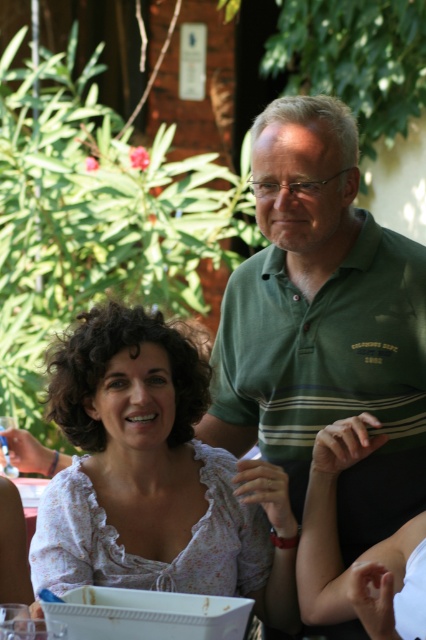
Question: Among these points, which one is farthest from the camera?

Choices:
 (A) (77, 342)
 (B) (264, 148)

Answer: (B)

Question: Does green striped polo shirt at center appear under white floral blouse at center?

Choices:
 (A) yes
 (B) no

Answer: (B)

Question: Where is green striped polo shirt at center located in relation to white floral blouse at center in the image?

Choices:
 (A) below
 (B) above

Answer: (B)

Question: Does green striped polo shirt at center have a larger size compared to white floral blouse at center?

Choices:
 (A) yes
 (B) no

Answer: (A)

Question: Which point is closer to the camera?

Choices:
 (A) (397, 257)
 (B) (138, 515)

Answer: (B)